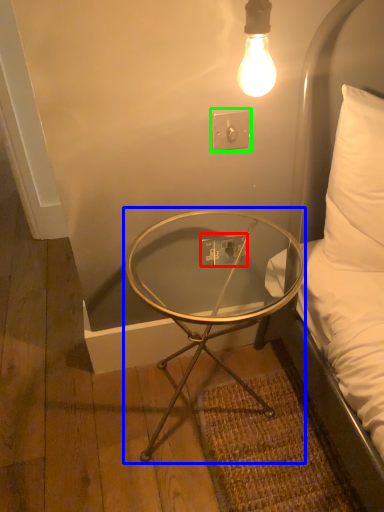
Question: Estimate the real-world distances between objects in this image. Which object is closer to electric outlet (highlighted by a red box), coffee table (highlighted by a blue box) or electric outlet (highlighted by a green box)?

Choices:
 (A) coffee table
 (B) electric outlet

Answer: (A)